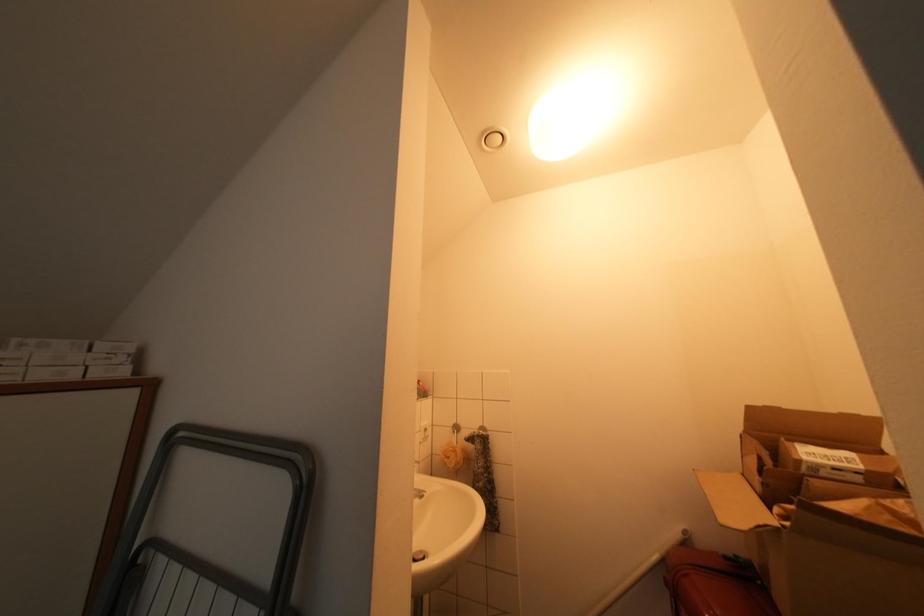
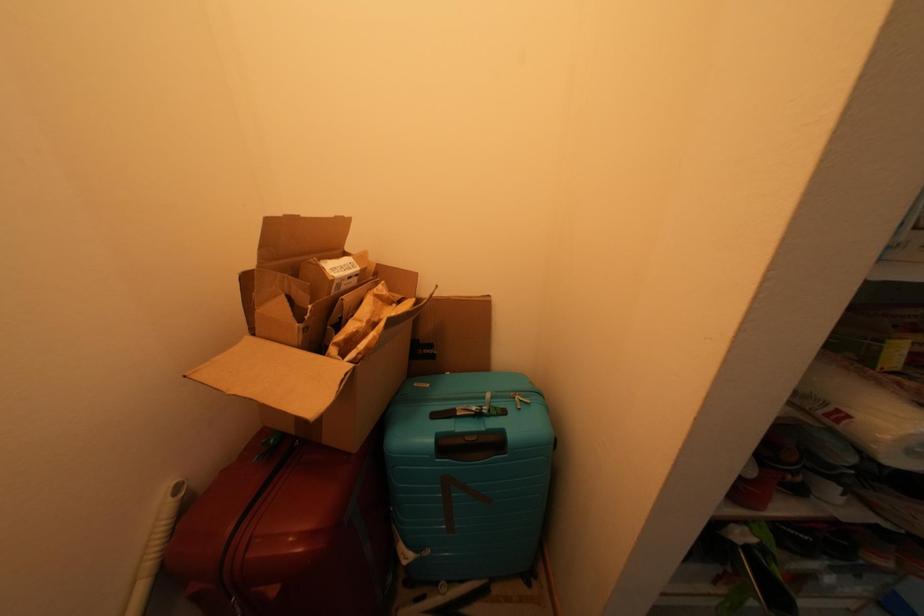
First-person continuous shooting, in which direction is the camera rotating?

The camera's rotation is toward right-down.